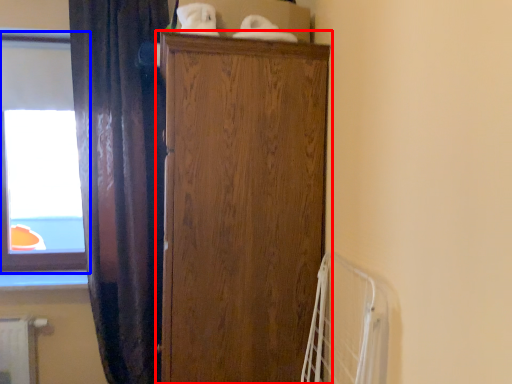
Question: Which object appears farthest to the camera in this image, cupboard (highlighted by a red box) or window (highlighted by a blue box)?

Choices:
 (A) cupboard
 (B) window

Answer: (B)